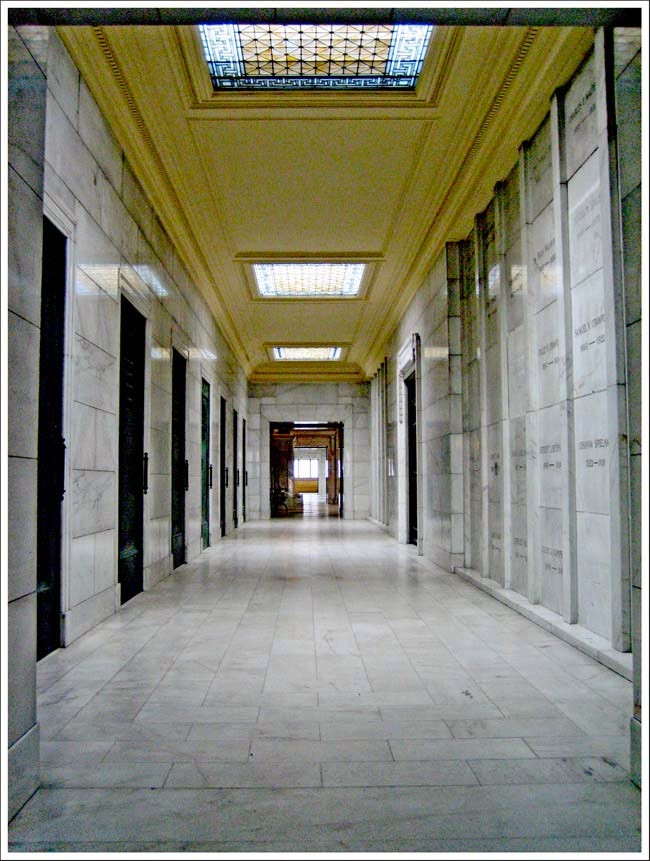
Find the location of a particular element. blue tiles is located at coordinates (404, 47), (402, 69), (403, 90), (356, 84), (318, 82), (281, 82), (221, 77), (223, 69), (229, 42).